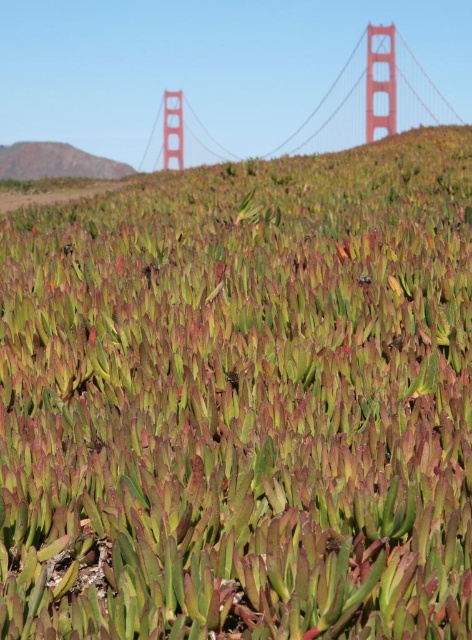
Question: Is red painted steel golden gate bridge at upper center to the right of green grassy hillside at upper left from the viewer's perspective?

Choices:
 (A) no
 (B) yes

Answer: (B)

Question: Which object appears closest to the camera in this image?

Choices:
 (A) green grassy hillside at upper left
 (B) red painted steel golden gate bridge at upper center

Answer: (B)

Question: Does red painted steel golden gate bridge at upper center appear over green grassy hillside at upper left?

Choices:
 (A) no
 (B) yes

Answer: (A)

Question: Does red painted steel golden gate bridge at upper center have a smaller size compared to green grassy hillside at upper left?

Choices:
 (A) no
 (B) yes

Answer: (A)

Question: Which object appears farthest from the camera in this image?

Choices:
 (A) red painted steel golden gate bridge at upper center
 (B) green grassy hillside at upper left

Answer: (B)